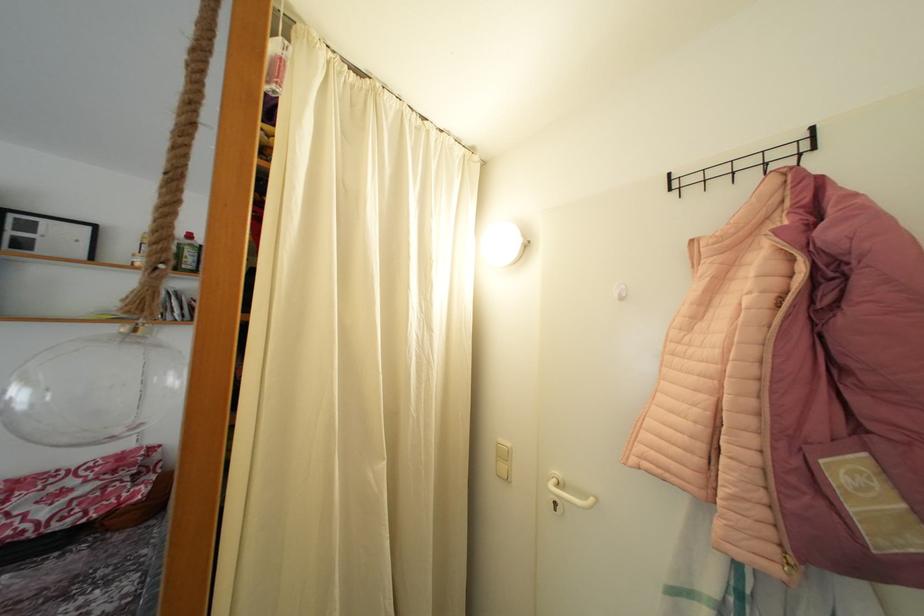
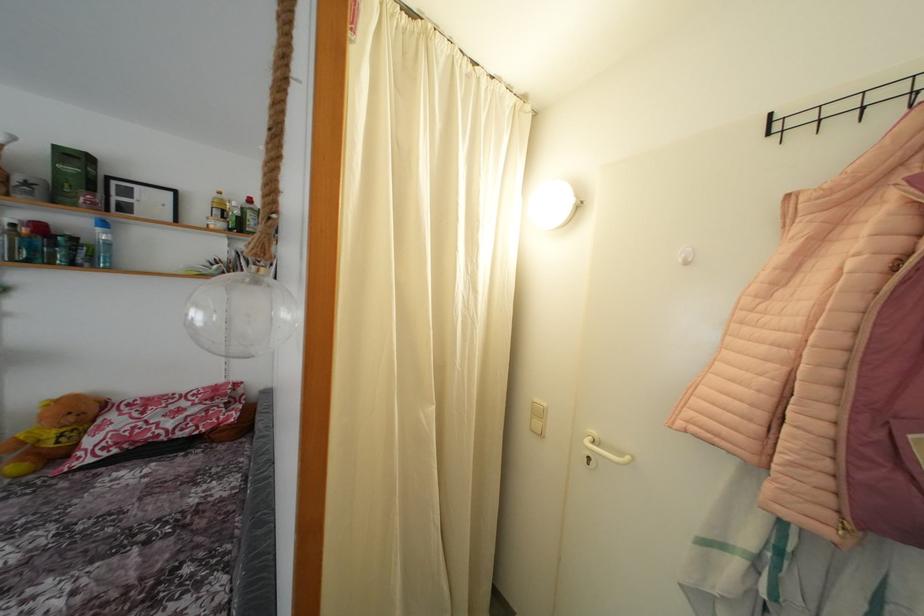
Locate, in the second image, the point that corresponds to the point at 679,191 in the first image.

(782, 134)